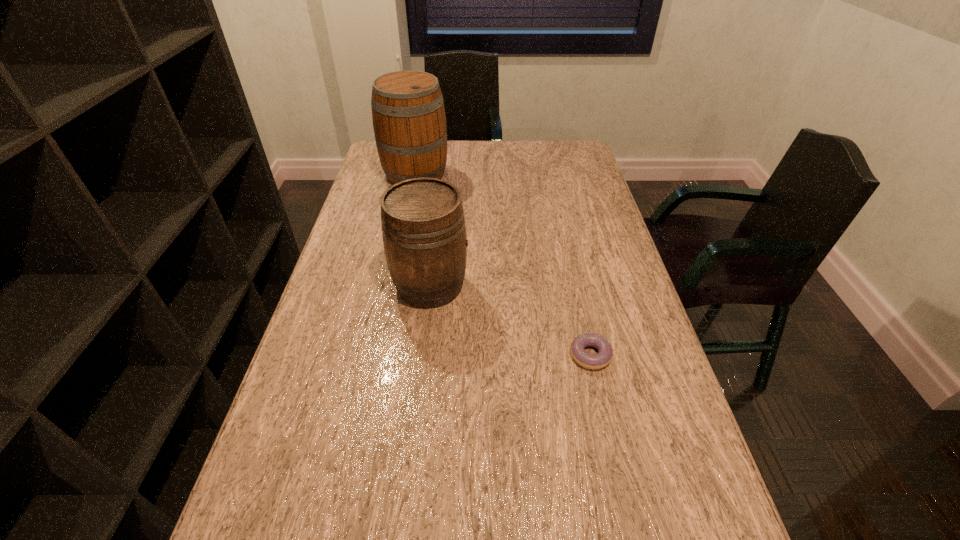
Locate an element on the screen. object that is at the left edge is located at coordinates (408, 113).

Where is `object that is at the right edge`? object that is at the right edge is located at coordinates (604, 356).

This screenshot has height=540, width=960. Find the location of `object situated at the far left corner`. object situated at the far left corner is located at coordinates (408, 113).

This screenshot has height=540, width=960. In the image, there is a desktop. In order to click on vacant space at the left edge in this screenshot , I will do `click(341, 252)`.

In the image, there is a desktop. At what (x,y) coordinates should I click in order to perform the action: click on vacant space at the right edge. Please return your answer as a coordinate pair (x, y). Looking at the image, I should click on (618, 273).

The height and width of the screenshot is (540, 960). In the image, there is a desktop. Find the location of `vacant region at the far right corner`. vacant region at the far right corner is located at coordinates (566, 144).

Find the location of `vacant space that is in between the doughnut and the farthest object`. vacant space that is in between the doughnut and the farthest object is located at coordinates (503, 265).

The height and width of the screenshot is (540, 960). Find the location of `empty space that is in between the taller cider and the doughnut`. empty space that is in between the taller cider and the doughnut is located at coordinates (503, 265).

Identify the location of unoccupied position between the rightmost object and the nearer cider. (511, 320).

Image resolution: width=960 pixels, height=540 pixels. I want to click on vacant area between the rightmost object and the shorter cider, so click(x=511, y=320).